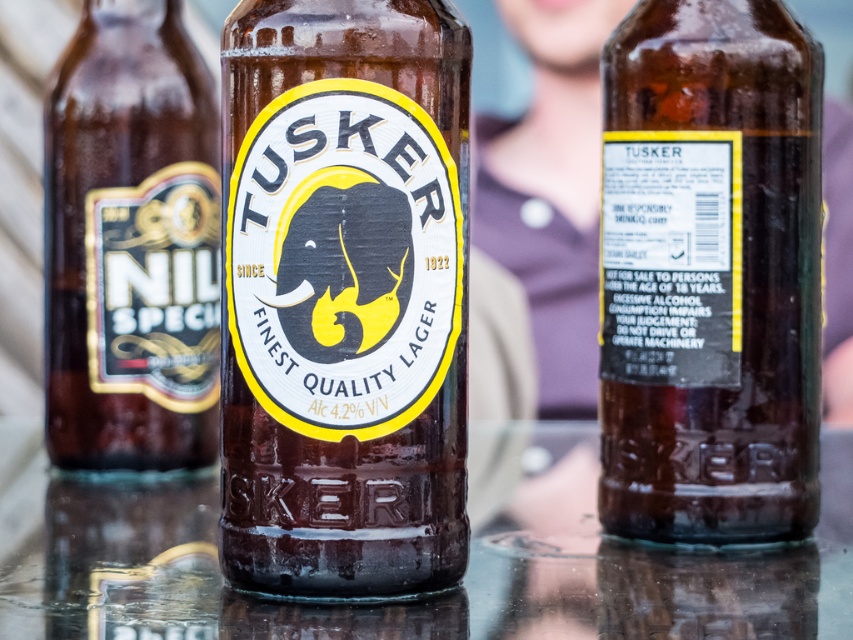
You are standing at the edge of the table where the bottles are placed. You want to reach for a point closer to you. Which point should you choose between point (329,326) and point (654,291)?

Point (329,326) is in front of point (654,291), so you should choose point (329,326) as it is closer to you.

You are arranging bottles on a table. You have a matte glass tusker lager at center and a brown glass bottle at center. If you want to place a coaster between them, what is the minimum diameter the coaster should have to fit between them?

The minimum diameter of the coaster should be at least 10.13 inches to fit between the matte glass tusker lager at center and the brown glass bottle at center.

You are a delivery person trying to place a new Tusker bottle on the table. The existing Tusker bottle is at point (781, 212), and there is another object at point (68, 317). Can you place the new Tusker bottle in front of the existing Tusker bottle without overlapping with the other object?

Point (781, 212) is in front of point (68, 317), so placing the new Tusker bottle in front of the existing Tusker bottle would mean placing it closer to the viewer than the existing Tusker bottle. However, since the existing Tusker bottle is already in front of the other object, there might not be enough space between them to place the new bottle without overlapping. Therefore, it might not be possible to place the new Tusker bottle in front of the existing one without overlapping the other object.